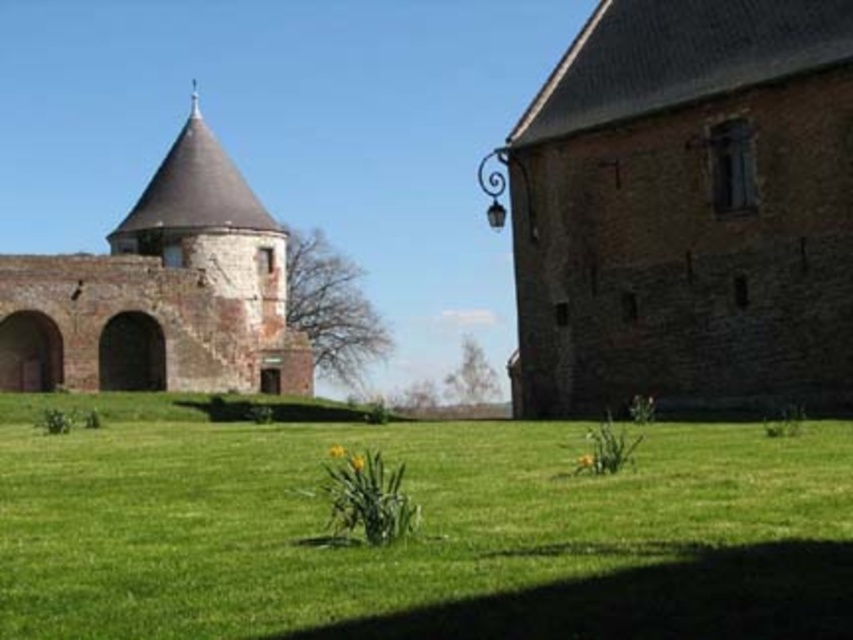
Can you confirm if brown brick church at right is positioned to the right of rustic brick tower at left?

Yes, brown brick church at right is to the right of rustic brick tower at left.

Consider the image. Who is more forward, (x=792, y=205) or (x=138, y=337)?

Point (x=792, y=205) is more forward.

Which is behind, point (682, 16) or point (253, 378)?

Positioned behind is point (253, 378).

The image size is (853, 640). I want to click on brown brick church at right, so click(688, 211).

Between point (436, 483) and point (144, 326), which one is positioned in front?

Positioned in front is point (436, 483).

What do you see at coordinates (422, 532) in the screenshot? The image size is (853, 640). I see `green grass at center` at bounding box center [422, 532].

You are a GUI agent. You are given a task and a screenshot of the screen. Output one action in this format:
    pyautogui.click(x=<x>, y=<y>)
    Task: Click on the green grass at center
    
    Given the screenshot: What is the action you would take?
    pyautogui.click(x=422, y=532)

Where is `green grass at center`? This screenshot has height=640, width=853. green grass at center is located at coordinates (422, 532).

Can you confirm if green grass at center is bigger than brown brick church at right?

No.

Is point (573, 525) farther from viewer compared to point (525, 266)?

That is False.

Which is in front, point (436, 609) or point (688, 262)?

Positioned in front is point (436, 609).

At what (x,y) coordinates should I click in order to perform the action: click on green grass at center. Please return your answer as a coordinate pair (x, y). Image resolution: width=853 pixels, height=640 pixels. Looking at the image, I should click on (422, 532).